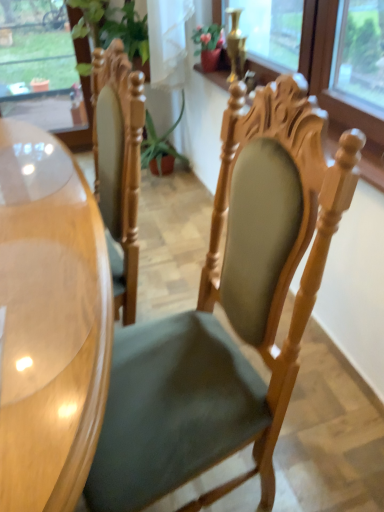
Question: In the image, is green fabric chair at center positioned in front of or behind glossy wood desk at left?

Choices:
 (A) front
 (B) behind

Answer: (B)

Question: In terms of height, does green fabric chair at center look taller or shorter compared to glossy wood desk at left?

Choices:
 (A) tall
 (B) short

Answer: (A)

Question: Which object is the farthest from the green fabric chair at center?

Choices:
 (A) glossy wood desk at left
 (B) transparent glass window at upper left

Answer: (B)

Question: Which object is the farthest from the green fabric chair at center?

Choices:
 (A) glossy wood desk at left
 (B) transparent glass window at upper left

Answer: (B)